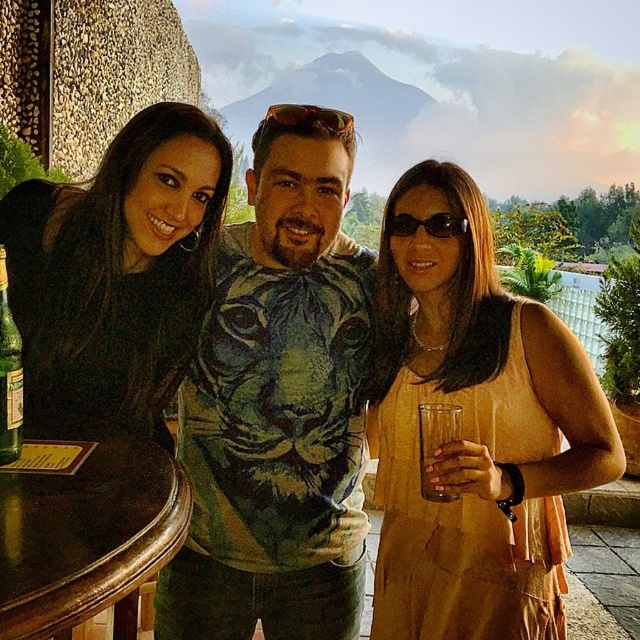
You are a photographer trying to capture a shot of the brown wood table at lower left and the green matte sunglasses at center. Based on their positions, which object should you focus on first if you want to ensure both are in the frame without moving the camera?

The brown wood table at lower left is below the green matte sunglasses at center, so you should focus on the green matte sunglasses at center first to ensure both are in the frame without moving the camera.

You are a photographer adjusting the camera settings to ensure both the matte yellow dress at center and the black matte shirt at center are in focus. Which clothing item should you focus on first to ensure proper depth of field?

The matte yellow dress at center is much taller than the black matte shirt at center, so focusing on the taller matte yellow dress at center first would help ensure both are in focus due to its greater height.

You are standing at the point marked by the coordinate point at point (552, 561). You want to walk to the round wooden table on the left. How far will you have to walk?

The distance between the point marked by the coordinate point at point (552, 561) and the round wooden table on the left is 1.52 meters, so you will have to walk 1.52 meters.